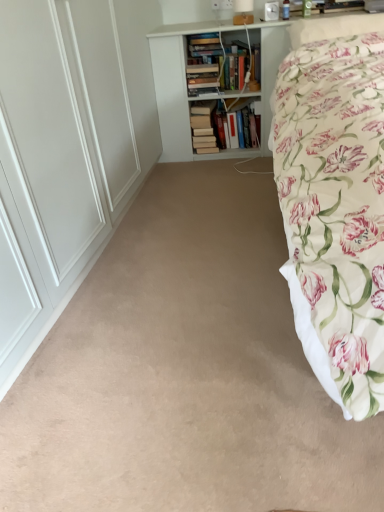
Question: Could you tell me if hardcover books at center is facing white wooden bookcase at upper center?

Choices:
 (A) yes
 (B) no

Answer: (A)

Question: Does hardcover books at center appear on the left side of white wooden bookcase at upper center?

Choices:
 (A) yes
 (B) no

Answer: (A)

Question: Is white wooden bookcase at upper center inside hardcover books at center?

Choices:
 (A) yes
 (B) no

Answer: (B)

Question: From a real-world perspective, is hardcover books at center below white wooden bookcase at upper center?

Choices:
 (A) no
 (B) yes

Answer: (B)

Question: Is hardcover books at center positioned with its back to white wooden bookcase at upper center?

Choices:
 (A) no
 (B) yes

Answer: (B)

Question: Is floral fabric pillow at upper right situated inside hardcover books at center or outside?

Choices:
 (A) inside
 (B) outside

Answer: (B)

Question: In terms of width, does floral fabric pillow at upper right look wider or thinner when compared to hardcover books at center?

Choices:
 (A) thin
 (B) wide

Answer: (B)

Question: Is floral fabric pillow at upper right taller or shorter than hardcover books at center?

Choices:
 (A) short
 (B) tall

Answer: (A)

Question: Is point (334, 17) closer or farther from the camera than point (198, 151)?

Choices:
 (A) farther
 (B) closer

Answer: (B)

Question: From a real-world perspective, relative to beige carpet at center, is white wooden bookcase at upper center vertically above or below?

Choices:
 (A) below
 (B) above

Answer: (B)

Question: In terms of width, does white wooden bookcase at upper center look wider or thinner when compared to beige carpet at center?

Choices:
 (A) thin
 (B) wide

Answer: (A)

Question: Which is correct: white wooden bookcase at upper center is inside beige carpet at center, or outside of it?

Choices:
 (A) outside
 (B) inside

Answer: (A)

Question: Is white wooden bookcase at upper center in front of or behind beige carpet at center in the image?

Choices:
 (A) front
 (B) behind

Answer: (B)

Question: Does point (306, 380) appear closer or farther from the camera than point (195, 137)?

Choices:
 (A) farther
 (B) closer

Answer: (B)

Question: From the image's perspective, relative to hardcover books at center, is beige carpet at center above or below?

Choices:
 (A) above
 (B) below

Answer: (B)